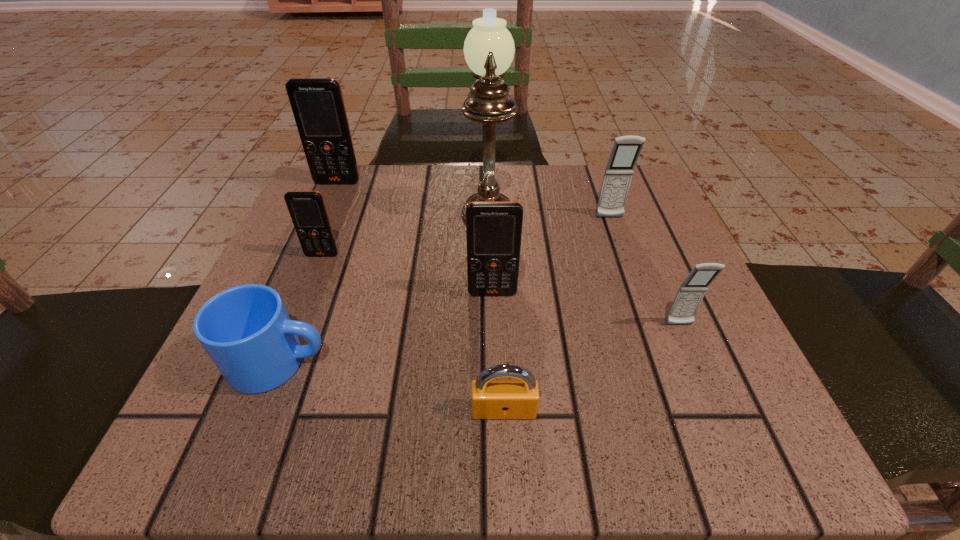
This screenshot has height=540, width=960. In order to click on the sixth closest object relative to the rightmost orange cellular telephone in this screenshot , I will do `click(626, 149)`.

Locate which object ranks in proximity to the third farthest cellular telephone. Please provide its 2D coordinates. Your answer should be formatted as a tuple, i.e. [(x, y)], where the tuple contains the x and y coordinates of a point satisfying the conditions above.

[(246, 331)]

Find the location of a particular element. the third closest cellular telephone to the tallest object is located at coordinates (317, 104).

Where is `cellular telephone that stands as the fourth closest to the mug`? cellular telephone that stands as the fourth closest to the mug is located at coordinates point(690,294).

This screenshot has height=540, width=960. Find the location of `the third closest orange cellular telephone to the tallest object`. the third closest orange cellular telephone to the tallest object is located at coordinates (307, 209).

Where is `orange cellular telephone that stands as the second closest to the second tallest object`? The height and width of the screenshot is (540, 960). orange cellular telephone that stands as the second closest to the second tallest object is located at coordinates (493, 228).

You are a GUI agent. You are given a task and a screenshot of the screen. Output one action in this format:
    pyautogui.click(x=<x>, y=<y>)
    Task: Click on the vacant space that satisfies the following two spatial constraints: 1. on the front-facing side of the left gray cellular telephone; 2. on the side of the mug with the handle
    
    Given the screenshot: What is the action you would take?
    pyautogui.click(x=660, y=362)